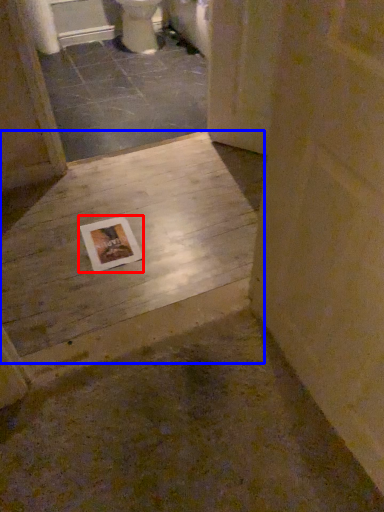
Question: Which object appears farthest to the camera in this image, postcard (highlighted by a red box) or concrete (highlighted by a blue box)?

Choices:
 (A) postcard
 (B) concrete

Answer: (A)